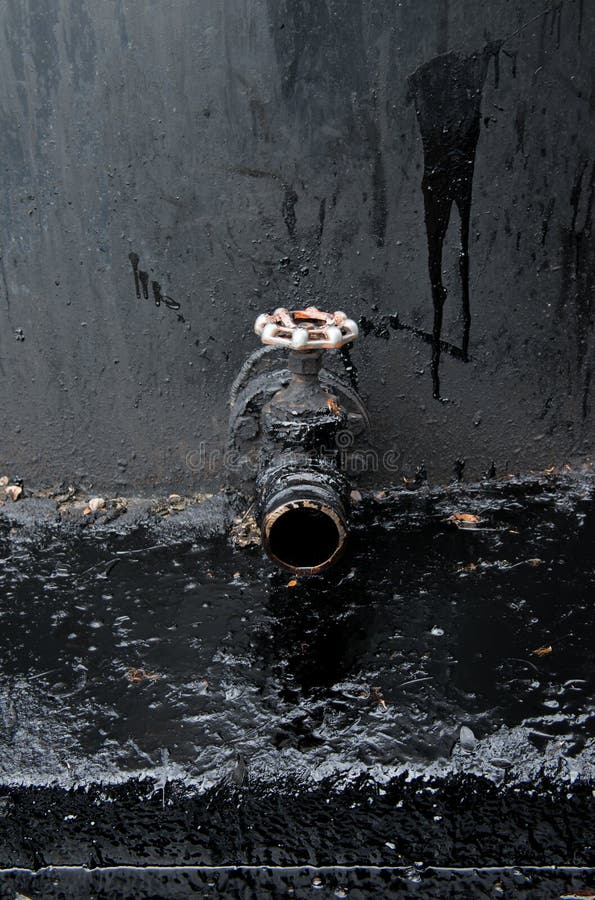
Locate an element on the screen. The height and width of the screenshot is (900, 595). dirt on wall is located at coordinates (192, 463), (402, 438).